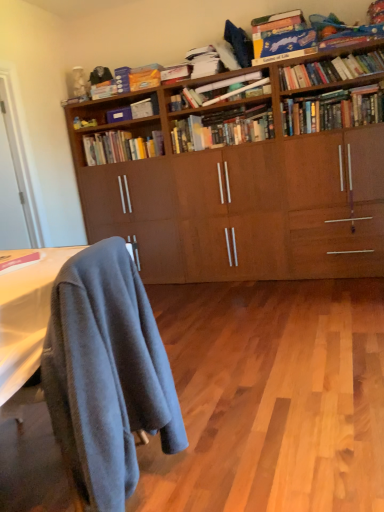
Question: Considering the relative positions of hardcover books at center, arranged as the 10th book when viewed from the top, and hardcover books at center, the ninth book viewed from the top, in the image provided, is hardcover books at center, arranged as the 10th book when viewed from the top, to the left or to the right of hardcover books at center, the ninth book viewed from the top,?

Choices:
 (A) left
 (B) right

Answer: (A)

Question: Looking at the image, does hardcover books at center, arranged as the 10th book when viewed from the top, seem bigger or smaller compared to hardcover books at center, the ninth book viewed from the top?

Choices:
 (A) small
 (B) big

Answer: (A)

Question: Based on their relative distances, which object is farther from the blue cardboard game at upper right, the tenth book ordered from the bottom?

Choices:
 (A) blue fuzzy blanket at lower left
 (B) matte pink book at lower left, the eleventh book from the top
 (C) hardcover books at upper right, which appears as the 4th book when ordered from the bottom
 (D) hardcover books at center, the ninth book viewed from the top
 (E) matte paper book at center, which is counted as the 7th book, starting from the top

Answer: (A)

Question: Which of these objects is positioned farthest from the blue cardboard game at upper right, the tenth book ordered from the bottom?

Choices:
 (A) matte cardboard box at upper center, which appears as the 7th book when ordered from the bottom
 (B) hardcover books at upper right, the sixth book when ordered from bottom to top
 (C) hardcover books at upper right, marked as the 8th book in a top-to-bottom arrangement
 (D) hardcover books at center, arranged as the 3th book when ordered from the bottom
 (E) hardcover books at center, which is the 2th book in bottom-to-top order

Answer: (A)